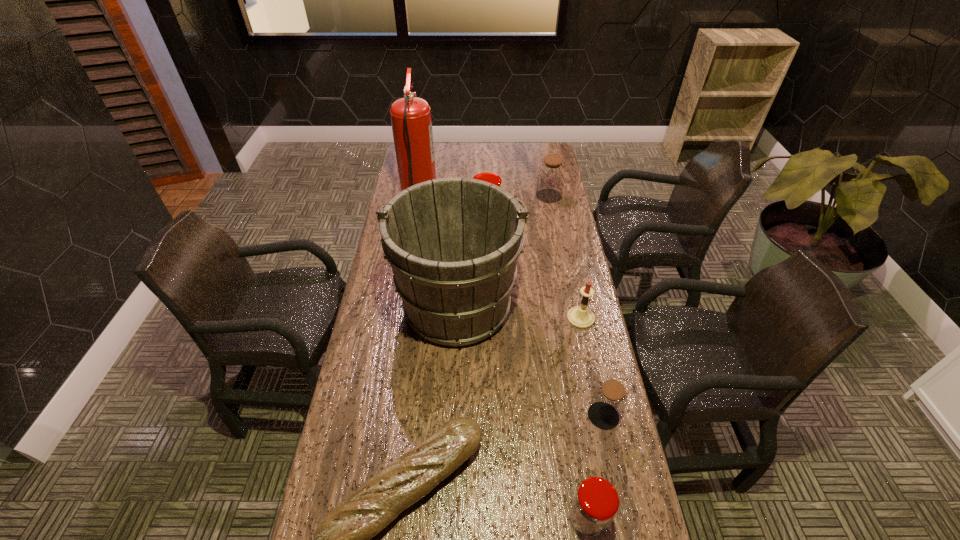
Locate an element on the screen. The image size is (960, 540). the third closest jar to the red fire extinguisher is located at coordinates (609, 400).

Where is `vacant region that satisfies the following two spatial constraints: 1. on the handle side of the farther red jar; 2. on the left side of the bucket`? The image size is (960, 540). vacant region that satisfies the following two spatial constraints: 1. on the handle side of the farther red jar; 2. on the left side of the bucket is located at coordinates (462, 216).

I want to click on free location that satisfies the following two spatial constraints: 1. on the instruction side of the tallest object; 2. on the back side of the second farthest jar, so click(x=416, y=216).

Where is `vacant area that satisfies the following two spatial constraints: 1. on the front side of the bigger red jar; 2. on the right side of the candle`? The height and width of the screenshot is (540, 960). vacant area that satisfies the following two spatial constraints: 1. on the front side of the bigger red jar; 2. on the right side of the candle is located at coordinates (488, 318).

This screenshot has height=540, width=960. I want to click on vacant space that satisfies the following two spatial constraints: 1. on the handle side of the second tallest object; 2. on the instruction side of the tallest object, so click(463, 198).